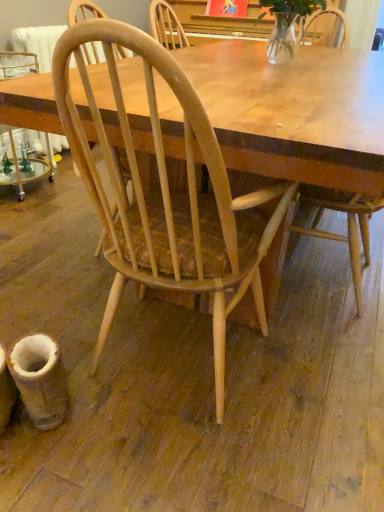
Question: Considering the relative sizes of natural wood chair at center, acting as the 1th chair starting from the left, and light wood chair at center, marked as the 2th chair in a left-to-right arrangement, in the image provided, is natural wood chair at center, acting as the 1th chair starting from the left, smaller than light wood chair at center, marked as the 2th chair in a left-to-right arrangement,?

Choices:
 (A) no
 (B) yes

Answer: (A)

Question: From a real-world perspective, is natural wood chair at center, acting as the 1th chair starting from the left, located higher than light wood chair at center, the first chair from the right?

Choices:
 (A) yes
 (B) no

Answer: (B)

Question: Can you confirm if natural wood chair at center, which is the second chair from right to left, is thinner than light wood chair at center, the first chair from the right?

Choices:
 (A) no
 (B) yes

Answer: (A)

Question: Is natural wood chair at center, acting as the 1th chair starting from the left, positioned behind light wood chair at center, the first chair from the right?

Choices:
 (A) yes
 (B) no

Answer: (B)

Question: Considering the relative sizes of natural wood chair at center, which is the second chair from right to left, and light wood chair at center, marked as the 2th chair in a left-to-right arrangement, in the image provided, is natural wood chair at center, which is the second chair from right to left, wider than light wood chair at center, marked as the 2th chair in a left-to-right arrangement,?

Choices:
 (A) yes
 (B) no

Answer: (A)

Question: From the image's perspective, is natural wood chair at center, acting as the 1th chair starting from the left, above or below clear glass vase at upper center?

Choices:
 (A) below
 (B) above

Answer: (A)

Question: From a real-world perspective, is natural wood chair at center, acting as the 1th chair starting from the left, positioned above or below clear glass vase at upper center?

Choices:
 (A) above
 (B) below

Answer: (B)

Question: Looking at the image, does natural wood chair at center, which is the second chair from right to left, seem bigger or smaller compared to clear glass vase at upper center?

Choices:
 (A) small
 (B) big

Answer: (B)

Question: In the image, is natural wood chair at center, which is the second chair from right to left, positioned in front of or behind clear glass vase at upper center?

Choices:
 (A) front
 (B) behind

Answer: (A)

Question: In terms of size, does clear glass vase at upper center appear bigger or smaller than light wood chair at center, the first chair from the right?

Choices:
 (A) small
 (B) big

Answer: (A)

Question: Relative to light wood chair at center, marked as the 2th chair in a left-to-right arrangement, is clear glass vase at upper center in front or behind?

Choices:
 (A) behind
 (B) front

Answer: (A)

Question: In terms of width, does clear glass vase at upper center look wider or thinner when compared to light wood chair at center, the first chair from the right?

Choices:
 (A) thin
 (B) wide

Answer: (A)

Question: Based on their positions, is clear glass vase at upper center located to the left or right of light wood chair at center, the first chair from the right?

Choices:
 (A) right
 (B) left

Answer: (B)

Question: In the image, is natural wood chair at center, which is the second chair from right to left, positioned in front of or behind light wood chair at center, the first chair from the right?

Choices:
 (A) behind
 (B) front

Answer: (B)

Question: From the image's perspective, is natural wood chair at center, acting as the 1th chair starting from the left, above or below light wood chair at center, marked as the 2th chair in a left-to-right arrangement?

Choices:
 (A) below
 (B) above

Answer: (A)